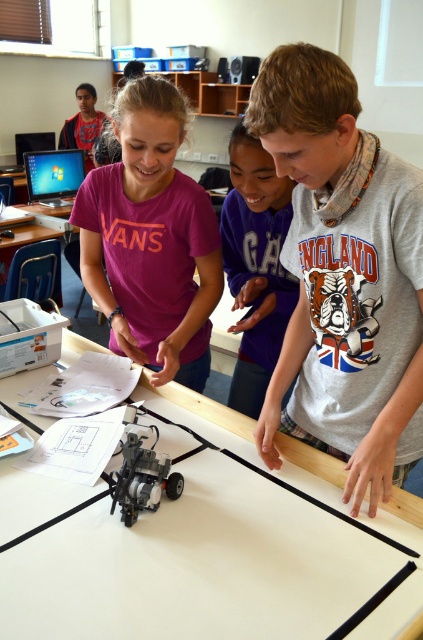
Does gray cotton shirt at center have a larger size compared to matte pink shirt at center?

No, gray cotton shirt at center is not bigger than matte pink shirt at center.

Image resolution: width=423 pixels, height=640 pixels. Describe the element at coordinates (343, 276) in the screenshot. I see `gray cotton shirt at center` at that location.

Locate an element on the screen. This screenshot has height=640, width=423. gray cotton shirt at center is located at coordinates (343, 276).

Can you confirm if matte pink shirt at center is thinner than white cotton shirt at upper center?

No.

Does matte pink shirt at center have a greater width compared to white cotton shirt at upper center?

Correct, the width of matte pink shirt at center exceeds that of white cotton shirt at upper center.

Which is behind, point (158, 310) or point (268, 166)?

Point (158, 310)

At what (x,y) coordinates should I click in order to perform the action: click on matte pink shirt at center. Please return your answer as a coordinate pair (x, y). The image size is (423, 640). Looking at the image, I should click on (151, 240).

Which is below, gray cotton shirt at center or white cotton shirt at upper center?

gray cotton shirt at center is lower down.

Is point (360, 262) behind point (235, 154)?

No.

Measure the distance between gray cotton shirt at center and camera.

33.28 inches

The image size is (423, 640). Find the location of `gray cotton shirt at center`. gray cotton shirt at center is located at coordinates (343, 276).